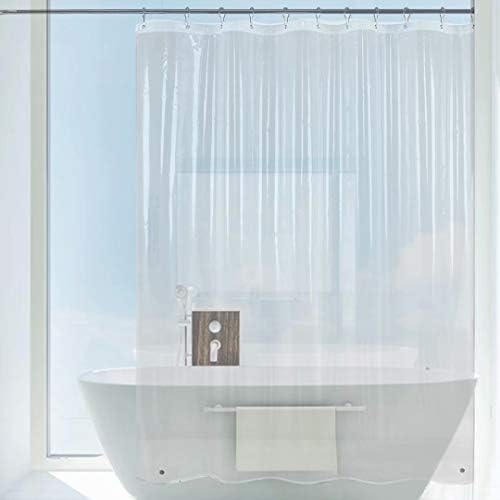
Find the location of a particular element. This screenshot has width=500, height=500. window is located at coordinates (313, 230).